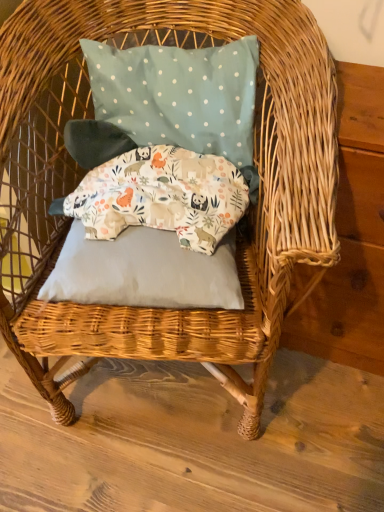
Question: Looking at their shapes, would you say gray fabric pillow at center, arranged as the first pillow when ordered from the bottom, is wider or thinner than teal polka dot fabric pillow at upper center, the 1th pillow when ordered from top to bottom?

Choices:
 (A) thin
 (B) wide

Answer: (B)

Question: Does point (203, 289) appear closer or farther from the camera than point (233, 140)?

Choices:
 (A) farther
 (B) closer

Answer: (B)

Question: Which of these objects is positioned closest to the teal polka dot fabric pillow at upper center, the 1th pillow when ordered from top to bottom?

Choices:
 (A) gray fabric pillow at center, arranged as the first pillow when ordered from the bottom
 (B) printed fabric pillow at center, placed as the second pillow when sorted from top to bottom

Answer: (B)

Question: Based on their relative distances, which object is farther from the teal polka dot fabric pillow at upper center, the 1th pillow when ordered from top to bottom?

Choices:
 (A) printed fabric pillow at center, placed as the second pillow when sorted from top to bottom
 (B) gray fabric pillow at center, arranged as the 3th pillow when viewed from the top

Answer: (B)